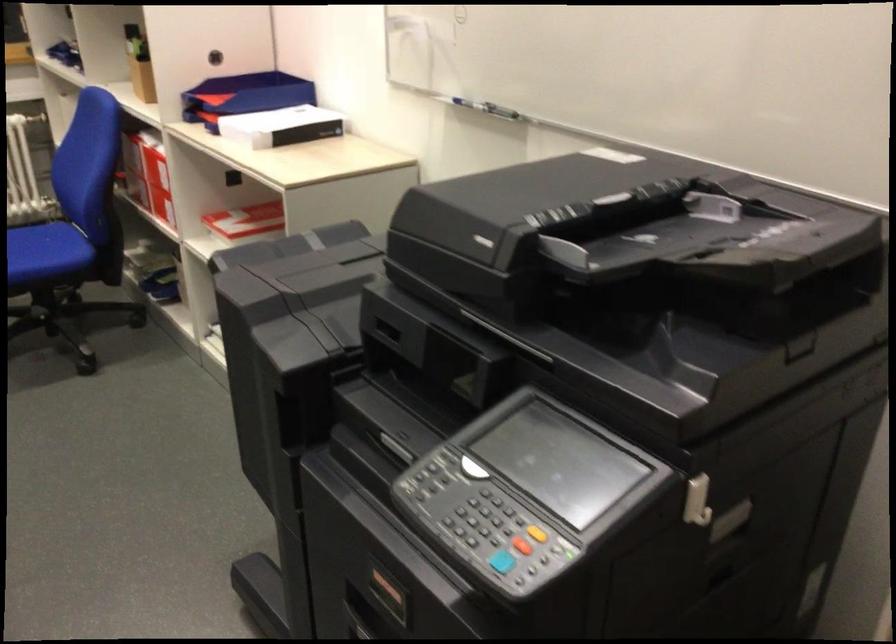
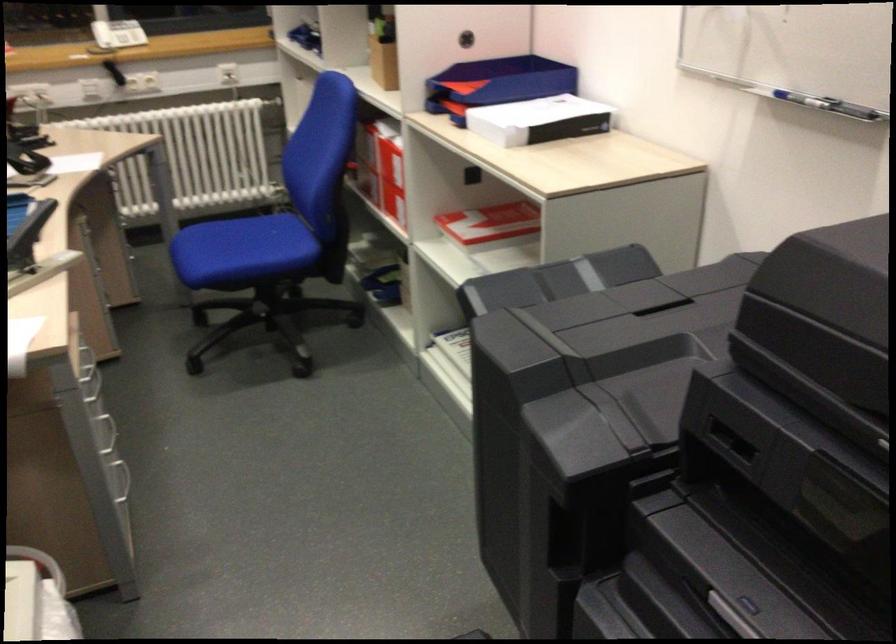
Locate, in the second image, the point that corresponds to (147,178) in the first image.

(380, 167)